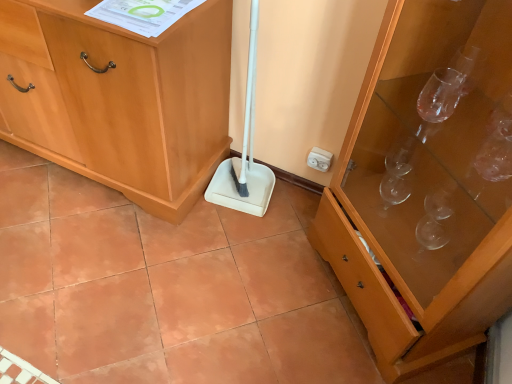
Where is `free region on the left part of transparent glass cabinet at right, acting as the first cabinetry starting from the right`? free region on the left part of transparent glass cabinet at right, acting as the first cabinetry starting from the right is located at coordinates (245, 286).